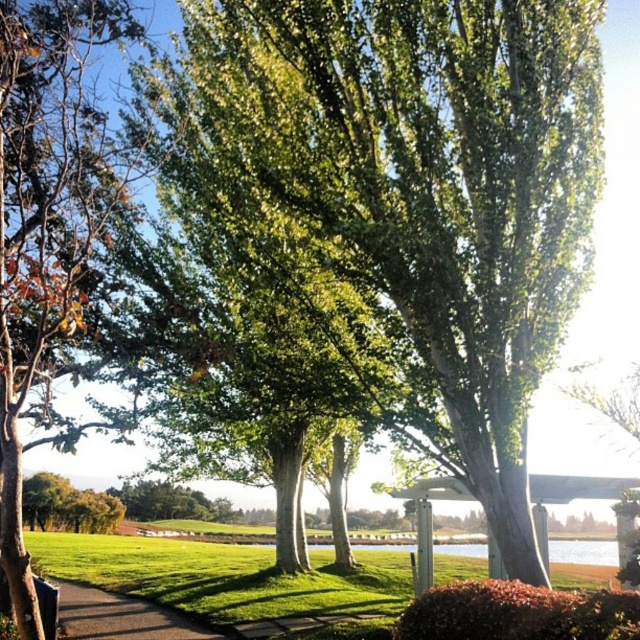
Question: Which of the following is the closest to the observer?

Choices:
 (A) (74, 612)
 (B) (13, 1)
 (C) (200, 550)
 (D) (449, 291)

Answer: (B)

Question: Is green leafy tree at center to the left of green grass at lower center from the viewer's perspective?

Choices:
 (A) yes
 (B) no

Answer: (B)

Question: Is green leafy tree at center further to camera compared to brown asphalt path at lower left?

Choices:
 (A) no
 (B) yes

Answer: (A)

Question: Among these points, which one is nearest to the camera?

Choices:
 (A) (403, 156)
 (B) (68, 637)
 (C) (17, 561)

Answer: (C)

Question: Can you confirm if green leafy tree at center is positioned to the right of green grass at lower center?

Choices:
 (A) yes
 (B) no

Answer: (A)

Question: Which object is the farthest from the brown asphalt path at lower left?

Choices:
 (A) green leafy tree at left
 (B) green grass at lower center

Answer: (B)